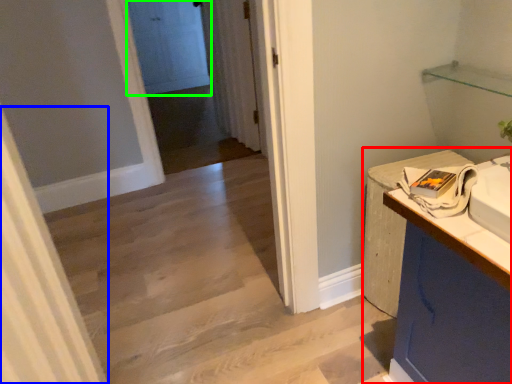
Question: Based on their relative distances, which object is nearer to counter (highlighted by a red box)? Choose from curtain (highlighted by a blue box) and door (highlighted by a green box).

Choices:
 (A) curtain
 (B) door

Answer: (A)